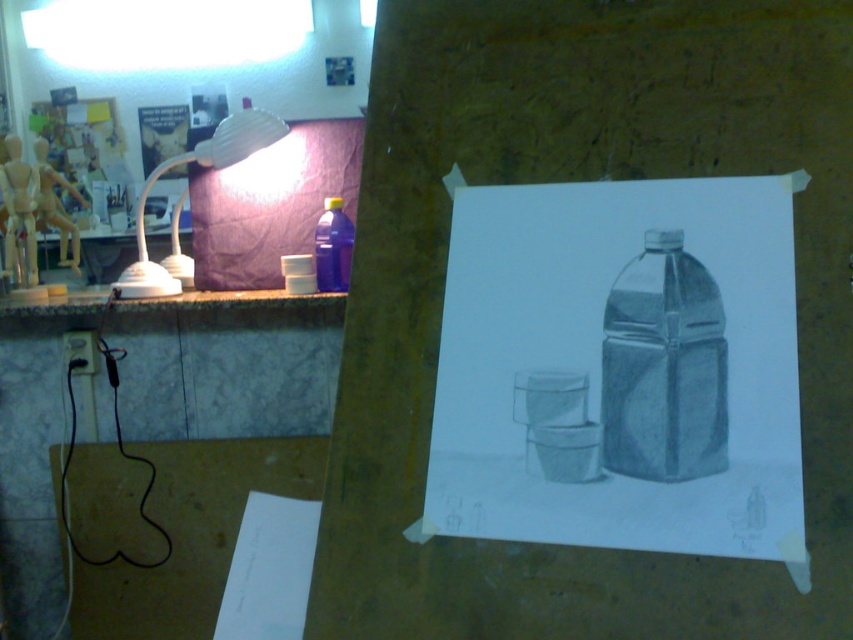
From the picture: Can you confirm if gray paper at center is shorter than matte gray plastic bottle at center?

In fact, gray paper at center may be taller than matte gray plastic bottle at center.

This screenshot has height=640, width=853. What do you see at coordinates (621, 369) in the screenshot?
I see `gray paper at center` at bounding box center [621, 369].

At what (x,y) coordinates should I click in order to perform the action: click on gray paper at center. Please return your answer as a coordinate pair (x, y). Looking at the image, I should click on (621, 369).

Between point (643, 364) and point (245, 144), which one is positioned in front?

Point (643, 364)

Is gray paper at center to the right of matte white lamp at upper left from the viewer's perspective?

Yes, gray paper at center is to the right of matte white lamp at upper left.

Where is `gray paper at center`? Image resolution: width=853 pixels, height=640 pixels. gray paper at center is located at coordinates (621, 369).

Who is taller, white paper at lower left or marble-like stone counter at left?

white paper at lower left

Does white paper at lower left appear on the right side of marble-like stone counter at left?

Indeed, white paper at lower left is positioned on the right side of marble-like stone counter at left.

Locate an element on the screen. Image resolution: width=853 pixels, height=640 pixels. white paper at lower left is located at coordinates (270, 570).